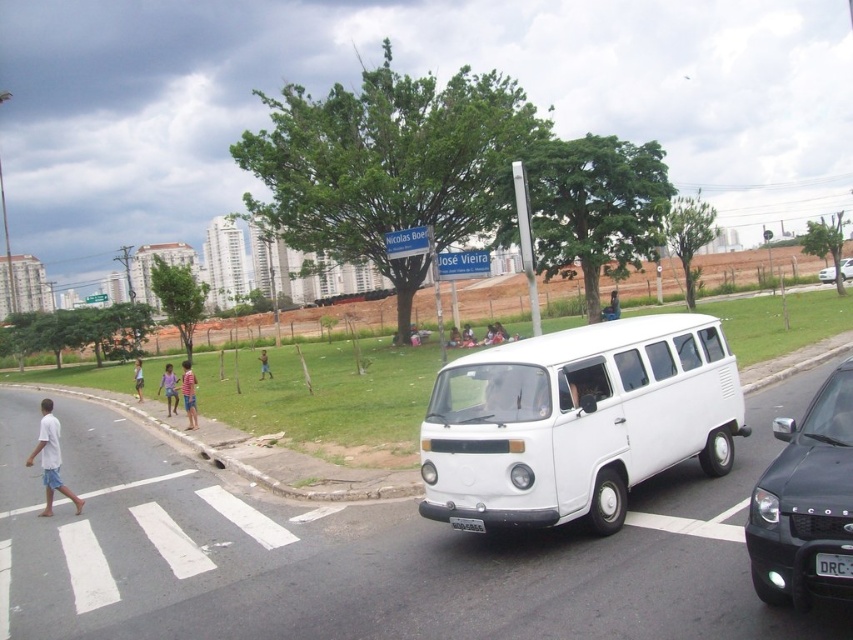
Where is `white cotton shirt at left`? Image resolution: width=853 pixels, height=640 pixels. white cotton shirt at left is located at coordinates (50, 458).

Image resolution: width=853 pixels, height=640 pixels. What do you see at coordinates (50, 458) in the screenshot?
I see `white cotton shirt at left` at bounding box center [50, 458].

Who is more distant from viewer, (53, 451) or (476, 525)?

The point (53, 451) is behind.

Find the location of `white cotton shirt at left`. white cotton shirt at left is located at coordinates (50, 458).

Can you confirm if white cotton shirt at left is positioned above light blue denim shorts at lower left?

No.

Is point (49, 483) less distant than point (141, 376)?

Yes, it is in front of point (141, 376).

Where is `white cotton shirt at left`? The width and height of the screenshot is (853, 640). white cotton shirt at left is located at coordinates (50, 458).

Is black glossy suv at right in front of white plastic license plate at center?

Yes, it is.

Describe the element at coordinates (805, 500) in the screenshot. The width and height of the screenshot is (853, 640). I see `black glossy suv at right` at that location.

Locate an element on the screen. The height and width of the screenshot is (640, 853). black glossy suv at right is located at coordinates (805, 500).